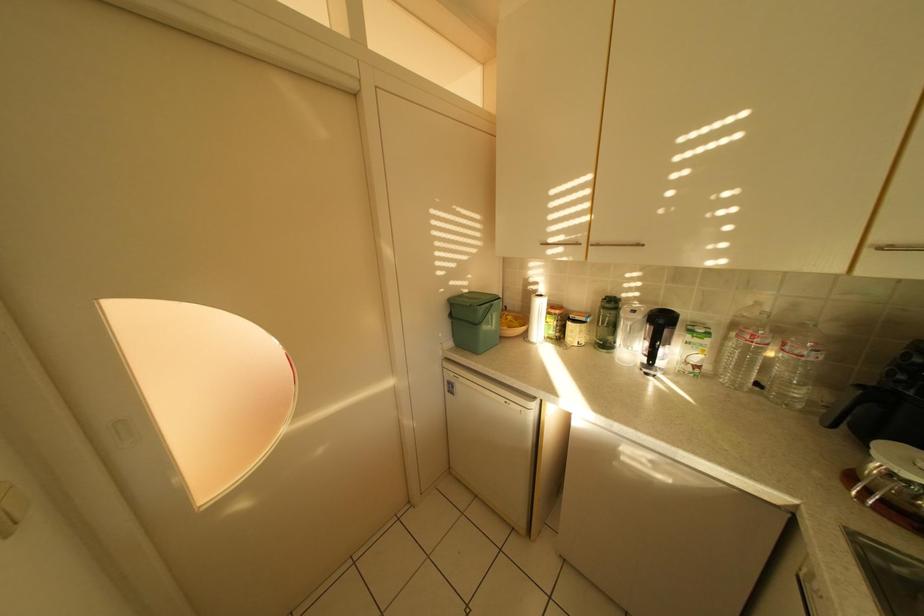
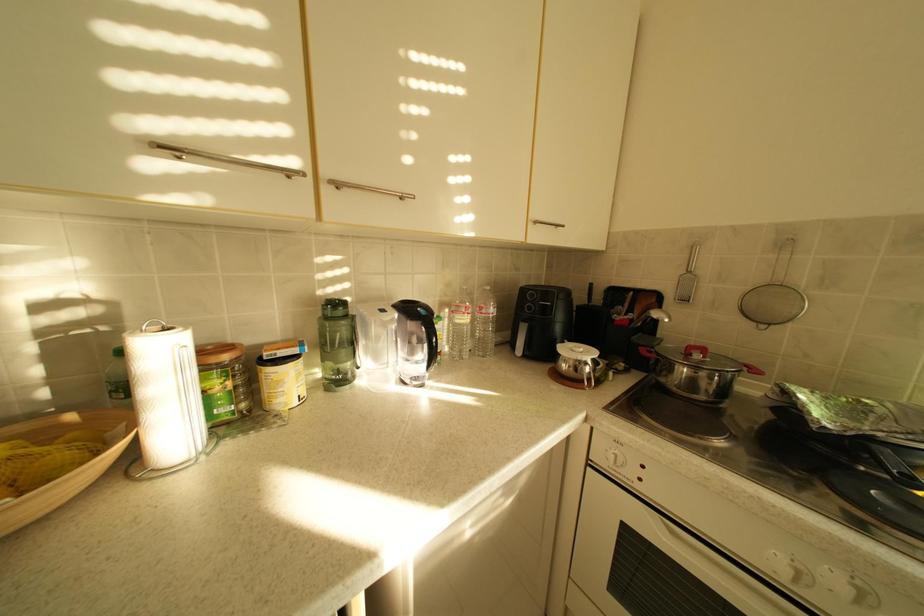
Question: The camera is either moving clockwise (left) or counter-clockwise (right) around the object. The first image is from the beginning of the video and the second image is from the end. Is the camera moving left or right when shooting the video?

Choices:
 (A) Left
 (B) Right

Answer: (A)